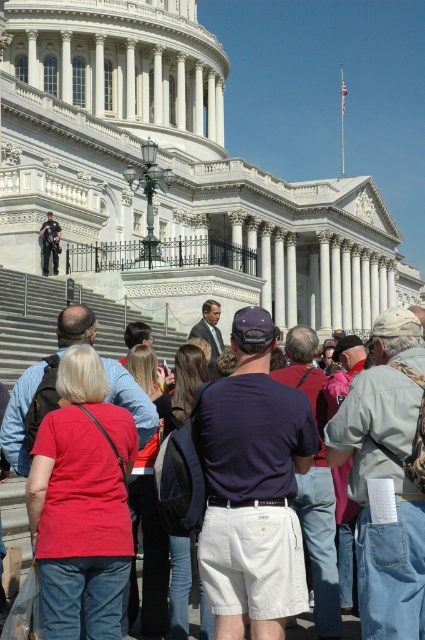
Question: Can you confirm if dark blue t-shirt at center is positioned to the right of dark blue backpack at center?

Choices:
 (A) no
 (B) yes

Answer: (B)

Question: Which point is closer to the camera taking this photo?

Choices:
 (A) (161, 586)
 (B) (411, 413)
 (C) (176, 557)
 (D) (102, 396)

Answer: (B)

Question: Is denim jacket at lower right above dark blue t-shirt at center?

Choices:
 (A) no
 (B) yes

Answer: (A)

Question: Which of these objects is positioned farthest from the denim jacket at lower right?

Choices:
 (A) dark blue backpack at center
 (B) red fabric shirt at center

Answer: (B)

Question: Where is matte red shirt at center located in relation to dark blue t-shirt at center in the image?

Choices:
 (A) above
 (B) below

Answer: (B)

Question: Among these points, which one is farthest from the camera?

Choices:
 (A) (303, 480)
 (B) (164, 604)
 (C) (175, 426)
 (D) (70, 397)

Answer: (C)